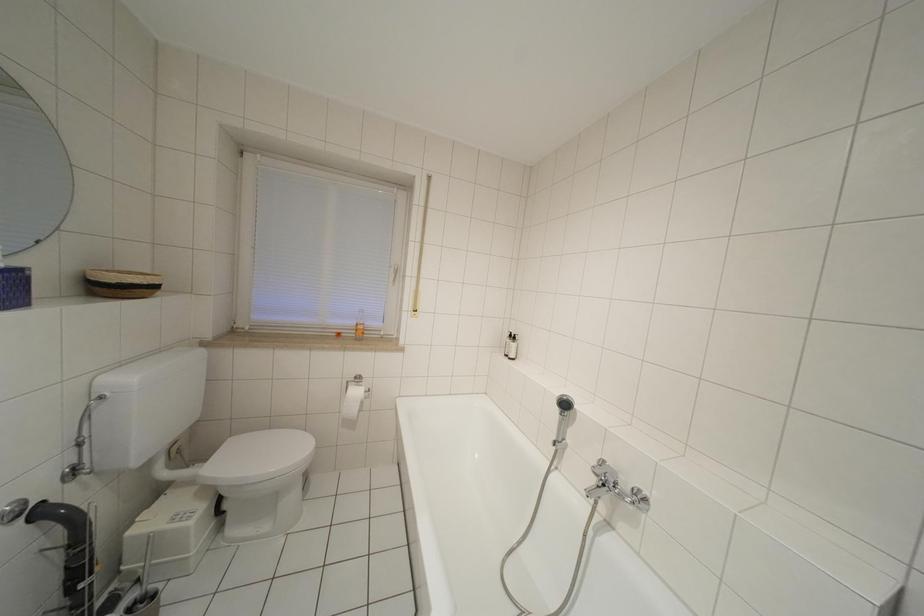
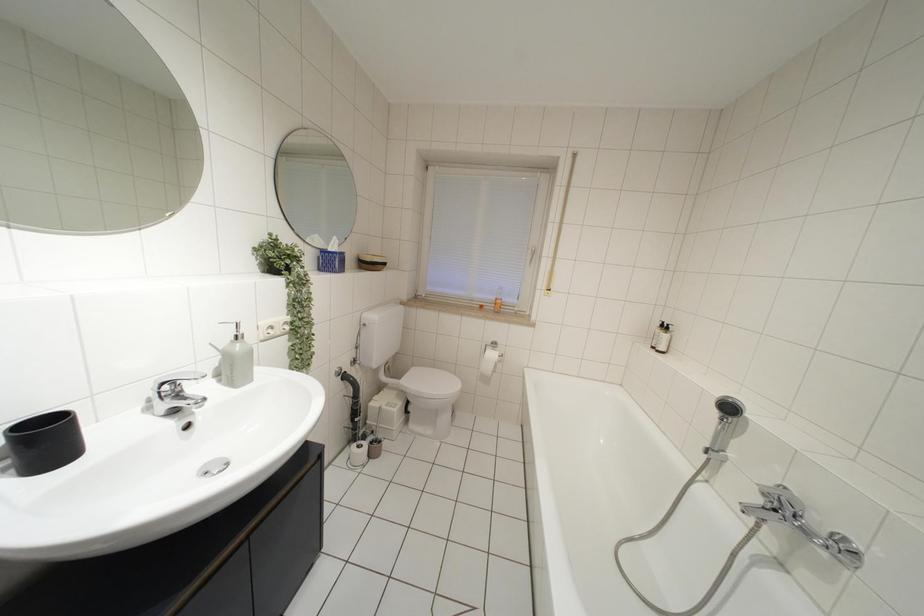
Question: The first image is from the beginning of the video and the second image is from the end. How did the camera likely rotate when shooting the video?

Choices:
 (A) Left
 (B) Right
 (C) Up
 (D) Down

Answer: (A)